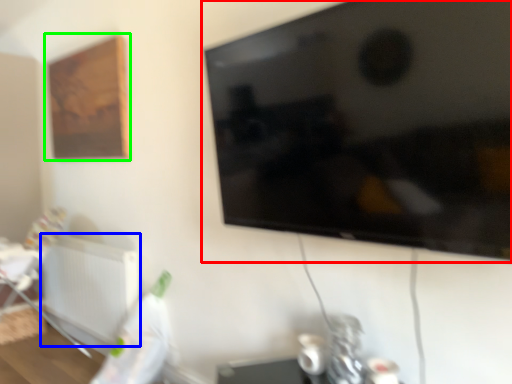
Question: Which object is positioned closest to television (highlighted by a red box)? Select from radiator (highlighted by a blue box) and picture frame (highlighted by a green box).

Choices:
 (A) radiator
 (B) picture frame

Answer: (B)